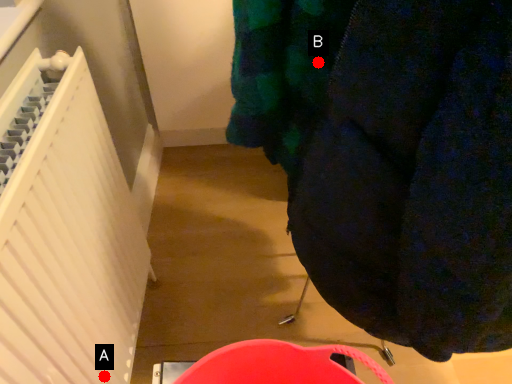
Question: Two points are circled on the image, labeled by A and B beside each circle. Which of the following is the closest to the observer?

Choices:
 (A) A is closer
 (B) B is closer

Answer: (B)